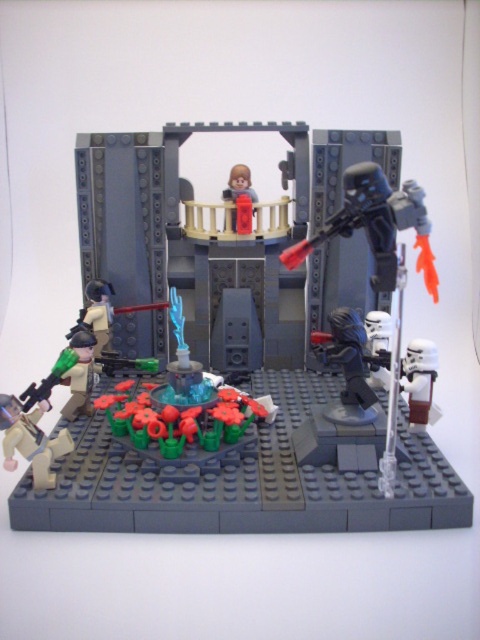
Between translucent plastic stormtrooper at upper right and smooth red figure at upper center, which one is positioned lower?

translucent plastic stormtrooper at upper right is lower down.

Is the position of translucent plastic stormtrooper at upper right more distant than that of smooth red figure at upper center?

No.

Between point (294, 134) and point (233, 216), which one is positioned behind?

Positioned behind is point (233, 216).

The height and width of the screenshot is (640, 480). What are the coordinates of `translucent plastic stormtrooper at upper right` in the screenshot? It's located at pyautogui.click(x=216, y=365).

Can you confirm if light brown plastic figure at lower left is smaller than smooth red figure at upper center?

No.

Can you confirm if light brown plastic figure at lower left is shorter than smooth red figure at upper center?

Yes.

Locate an element on the screen. light brown plastic figure at lower left is located at coordinates (31, 440).

In the scene shown: Who is positioned more to the right, translucent plastic stormtrooper at upper right or light brown plastic figure at lower left?

Positioned to the right is translucent plastic stormtrooper at upper right.

Describe the element at coordinates (216, 365) in the screenshot. I see `translucent plastic stormtrooper at upper right` at that location.

You are a GUI agent. You are given a task and a screenshot of the screen. Output one action in this format:
    pyautogui.click(x=<x>, y=<y>)
    Task: Click on the translucent plastic stormtrooper at upper right
    This screenshot has height=640, width=480.
    Given the screenshot: What is the action you would take?
    click(x=216, y=365)